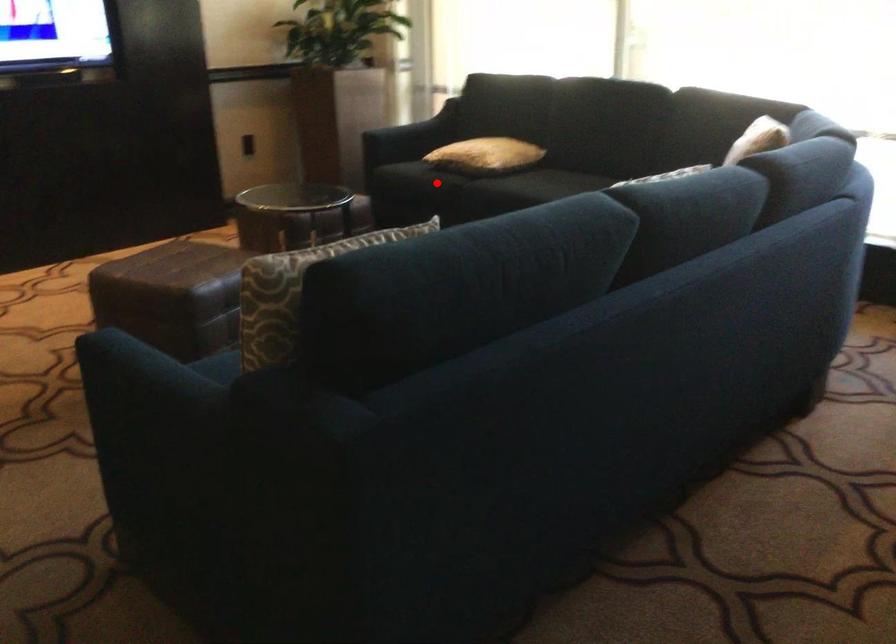
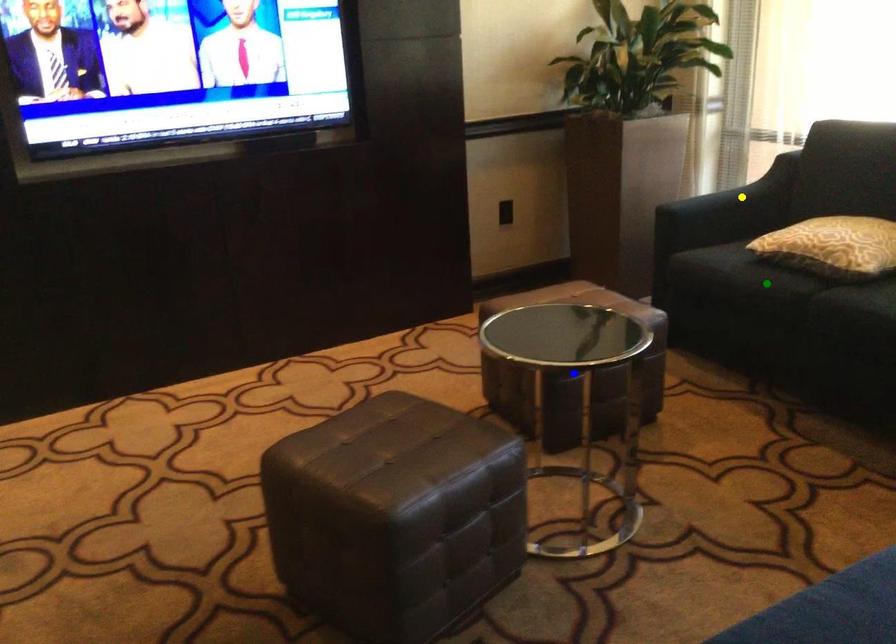
Question: I am providing you with two images of the same scene from different viewpoints. A red point is marked on the first image. You are given multiple points on the second image. Which point in image 2 is actually the same real-world point as the red point in image 1?

Choices:
 (A) blue point
 (B) green point
 (C) yellow point

Answer: (B)